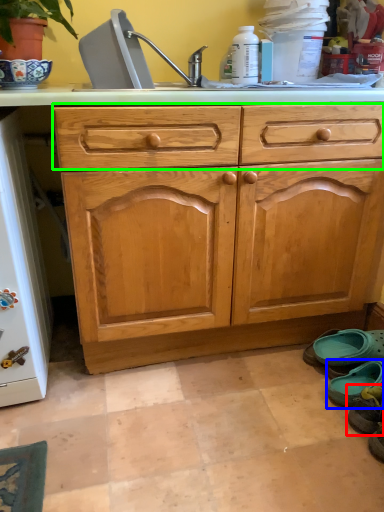
Question: Which object is the farthest from footwear (highlighted by a red box)? Choose among these: footwear (highlighted by a blue box) or drawer (highlighted by a green box).

Choices:
 (A) footwear
 (B) drawer

Answer: (B)